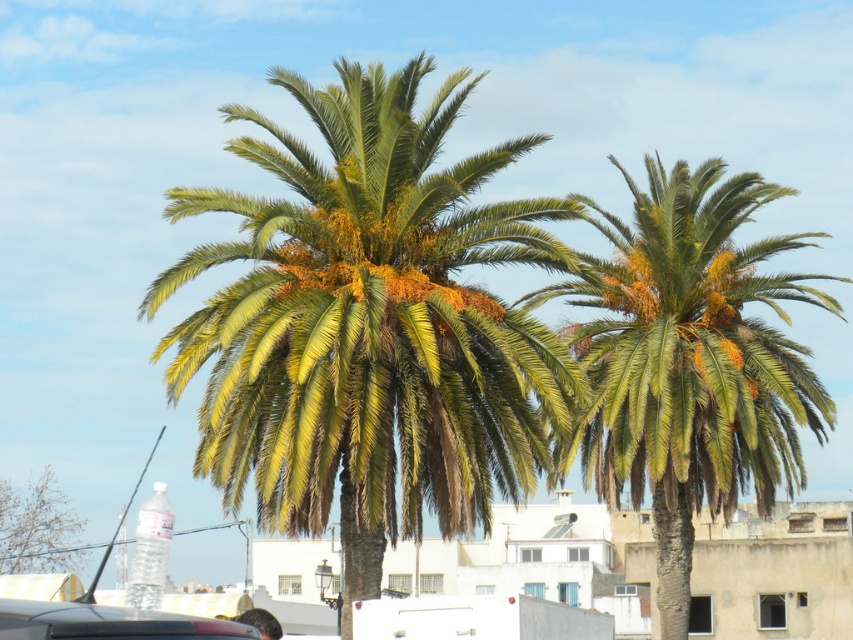
Based on the photo, you are a pedestrian standing at the edge of the road. You see a matte black car at lower left and a green leafy palm at lower left. Which object is closer to you?

The matte black car at lower left is closer to you because it is in front of the green leafy palm at lower left.

You are a delivery driver who needs to park your matte black car at lower left close to the green leafy palm at right. Considering the width of both objects, will your car fit in the space next to the palm without touching it?

The green leafy palm at right is wider than the matte black car at lower left. Therefore, the car should fit in the space next to the palm without touching it, as the palm is wider, providing enough space for the car.

You are a delivery driver who needs to park your matte black car at lower left close to the green leafy palm at right for unloading. Considering the size difference between them, can you safely park the car without damaging the palm?

The green leafy palm at right is larger than the matte black car at lower left. Since the palm is bigger, there should be enough space to park the matte black car at lower left near it without causing damage.